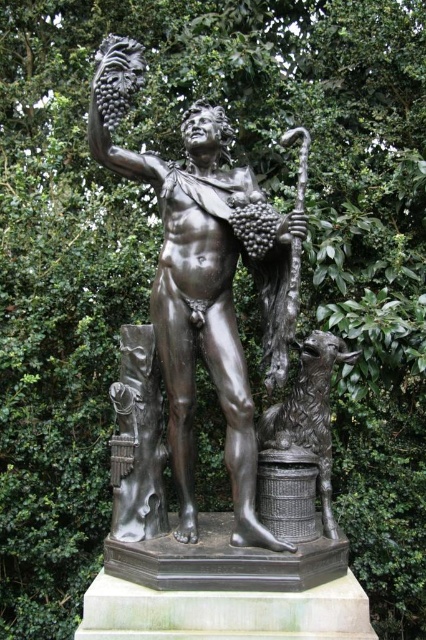
Can you confirm if bronze statue at center is thinner than shiny bronze basket at lower center?

Incorrect, bronze statue at center's width is not less than shiny bronze basket at lower center's.

Is the position of bronze statue at center more distant than that of shiny bronze basket at lower center?

No, it is not.

Is point (227, 371) positioned in front of point (328, 508)?

Yes, it is.

The image size is (426, 640). Find the location of `bronze statue at center`. bronze statue at center is located at coordinates (201, 280).